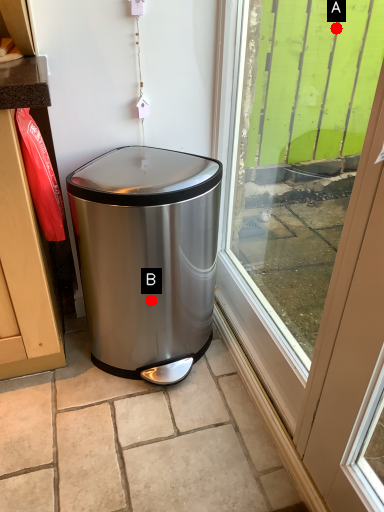
Question: Two points are circled on the image, labeled by A and B beside each circle. Which point appears farthest from the camera in this image?

Choices:
 (A) A is further
 (B) B is further

Answer: (A)